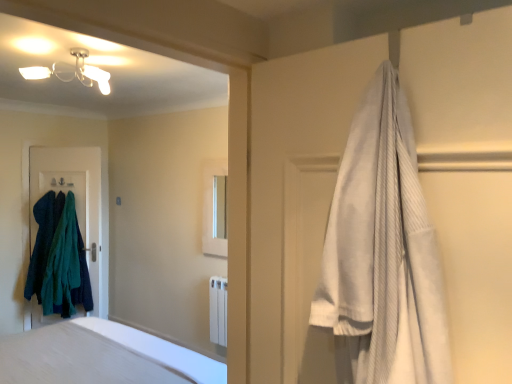
Question: Can you confirm if dark green fuzzy sweater at left, arranged as the second clothing when viewed from the right, is taller than white soft bed at center?

Choices:
 (A) yes
 (B) no

Answer: (A)

Question: From a real-world perspective, is dark green fuzzy sweater at left, which is counted as the first clothing, starting from the left, under white soft bed at center?

Choices:
 (A) yes
 (B) no

Answer: (A)

Question: Does dark green fuzzy sweater at left, arranged as the second clothing when viewed from the right, have a larger size compared to white soft bed at center?

Choices:
 (A) no
 (B) yes

Answer: (B)

Question: Can you confirm if dark green fuzzy sweater at left, which is counted as the first clothing, starting from the left, is wider than white soft bed at center?

Choices:
 (A) yes
 (B) no

Answer: (A)

Question: Is dark green fuzzy sweater at left, which is counted as the first clothing, starting from the left, at the left side of white soft bed at center?

Choices:
 (A) no
 (B) yes

Answer: (B)

Question: From a real-world perspective, is dark blue fabric at left positioned above or below white glossy medicine cabinet at center?

Choices:
 (A) below
 (B) above

Answer: (A)

Question: Considering the positions of dark blue fabric at left and white glossy medicine cabinet at center in the image, is dark blue fabric at left bigger or smaller than white glossy medicine cabinet at center?

Choices:
 (A) small
 (B) big

Answer: (B)

Question: Considering the relative positions of dark blue fabric at left and white glossy medicine cabinet at center in the image provided, is dark blue fabric at left to the left or to the right of white glossy medicine cabinet at center?

Choices:
 (A) right
 (B) left

Answer: (B)

Question: Which is correct: dark blue fabric at left is inside white glossy medicine cabinet at center, or outside of it?

Choices:
 (A) outside
 (B) inside

Answer: (A)

Question: Is point (65, 236) closer or farther from the camera than point (19, 345)?

Choices:
 (A) farther
 (B) closer

Answer: (A)

Question: From the image's perspective, is teal fuzzy sweater at left, the second clothing from the left, above or below white smooth bathtub at lower left?

Choices:
 (A) below
 (B) above

Answer: (B)

Question: Considering their positions, is teal fuzzy sweater at left, the second clothing from the left, located in front of or behind white smooth bathtub at lower left?

Choices:
 (A) behind
 (B) front

Answer: (A)

Question: In terms of size, does teal fuzzy sweater at left, the second clothing from the left, appear bigger or smaller than white smooth bathtub at lower left?

Choices:
 (A) big
 (B) small

Answer: (B)

Question: Is teal fuzzy sweater at left, the second clothing from the left, bigger or smaller than white glossy medicine cabinet at center?

Choices:
 (A) small
 (B) big

Answer: (B)

Question: Do you think teal fuzzy sweater at left, arranged as the first clothing when viewed from the right, is within white glossy medicine cabinet at center, or outside of it?

Choices:
 (A) outside
 (B) inside

Answer: (A)